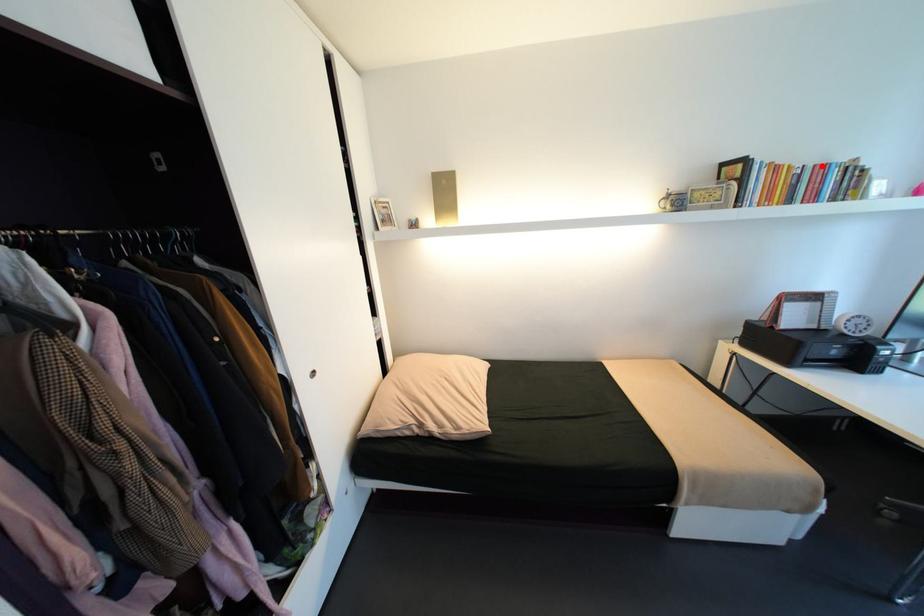
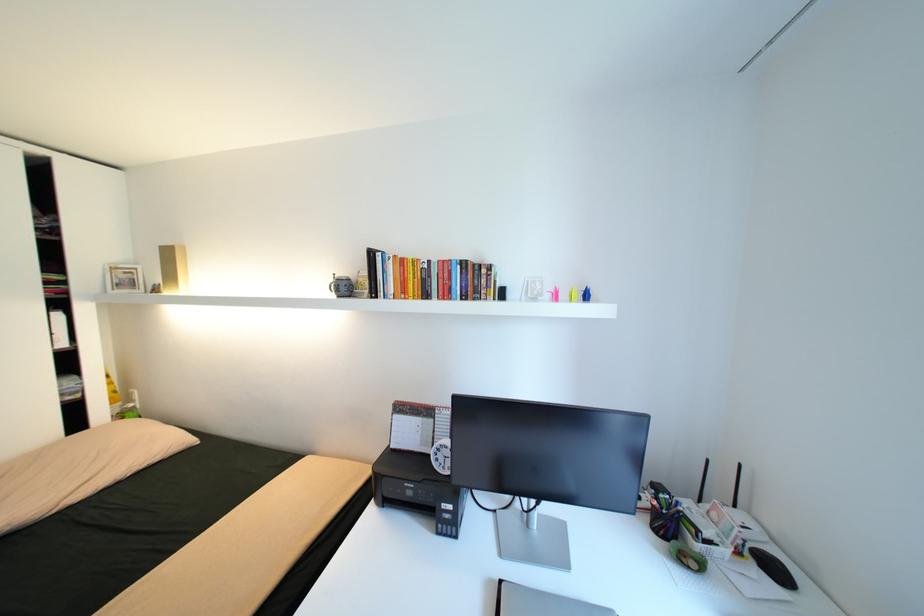
The point at the highlighted location is marked in the first image. Where is the corresponding point in the second image?

(445, 262)